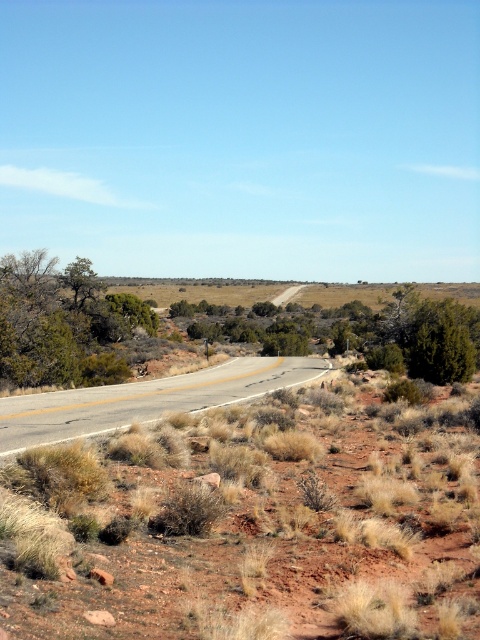
Does point (459, 628) come closer to viewer compared to point (412, 352)?

Yes, point (459, 628) is closer to viewer.

Is dry grass at center closer to camera compared to green shrubbery at center?

Yes, it is.

Between point (168, 401) and point (31, 275), which one is positioned in front?

Point (168, 401)

Where is `dry grass at center`? dry grass at center is located at coordinates (245, 512).

Who is more distant from viewer, (76, 298) or (8, 404)?

The point (76, 298) is more distant.

Who is shorter, green shrubbery at center or asphalt road at center?

asphalt road at center is shorter.

Is point (313, 328) less distant than point (176, 396)?

That is False.

At what (x,y) coordinates should I click in order to perform the action: click on green shrubbery at center. Please return your answer as a coordinate pair (x, y). The height and width of the screenshot is (640, 480). Looking at the image, I should click on (64, 323).

Who is lower down, dry grass at center or asphalt road at center?

Positioned lower is asphalt road at center.

Which is more to the left, dry grass at center or asphalt road at center?

asphalt road at center

This screenshot has width=480, height=640. I want to click on dry grass at center, so click(x=245, y=512).

You are a GUI agent. You are given a task and a screenshot of the screen. Output one action in this format:
    pyautogui.click(x=<x>, y=<y>)
    Task: Click on the dry grass at center
    This screenshot has width=480, height=640.
    Given the screenshot: What is the action you would take?
    pyautogui.click(x=245, y=512)